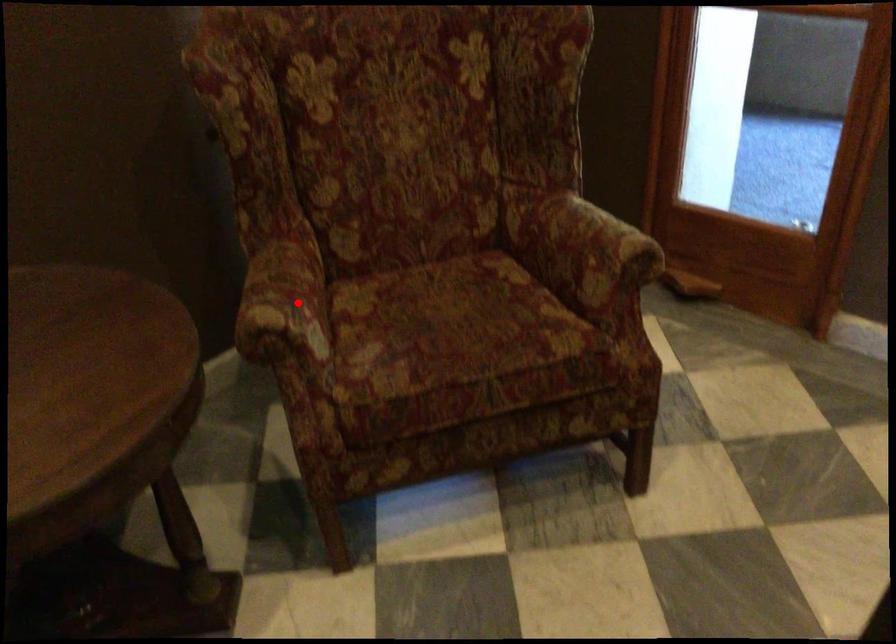
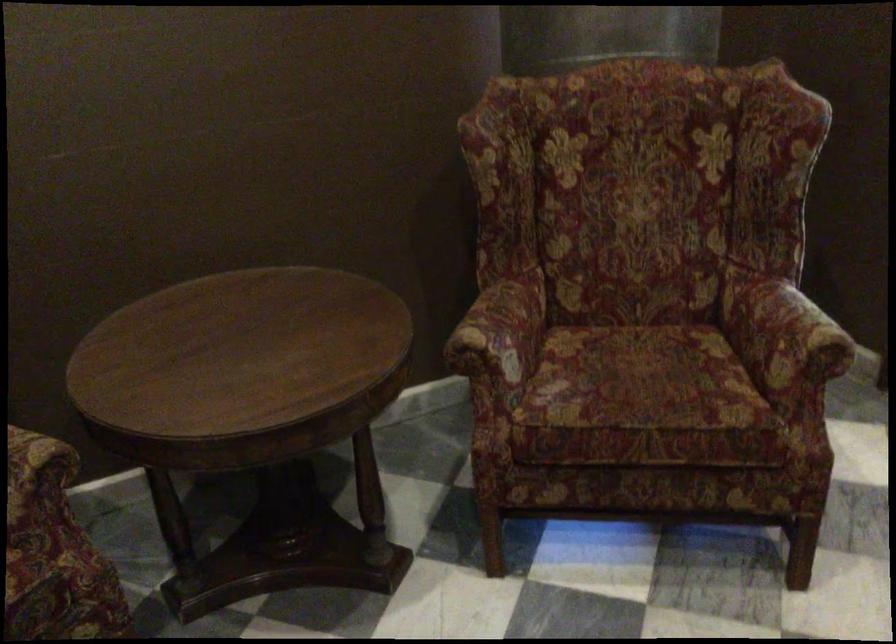
Find the pixel in the second image that matches the highlighted location in the first image.

(501, 330)